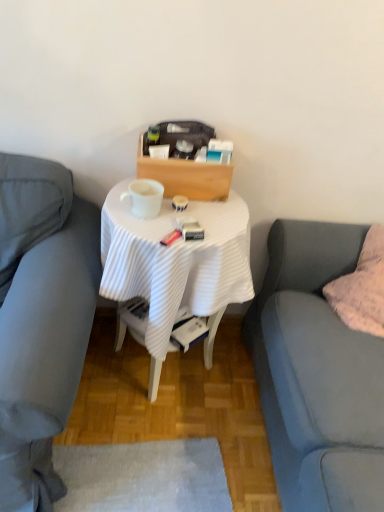
Find the location of a particular element. vacant point above white ribbed cloth at center (from a real-world perspective) is located at coordinates (184, 208).